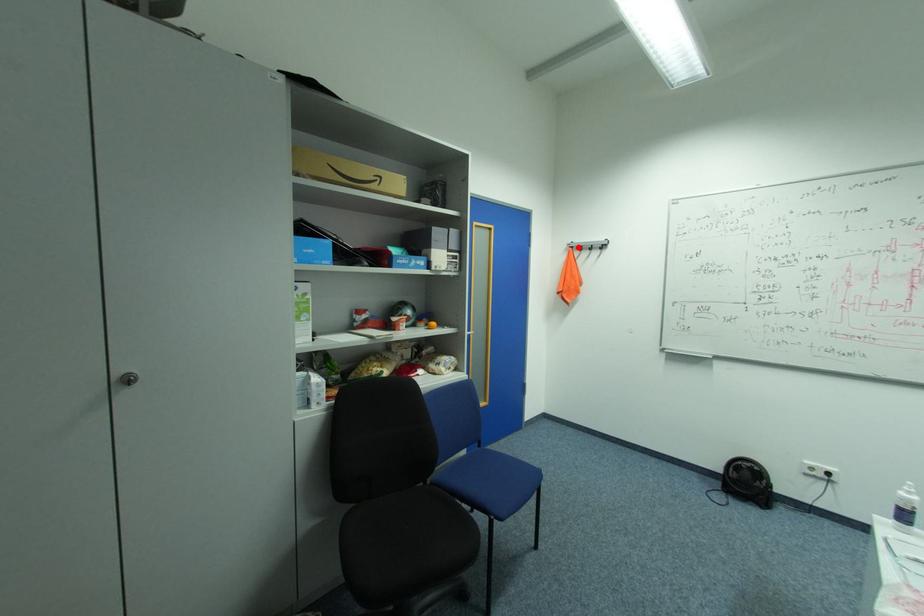
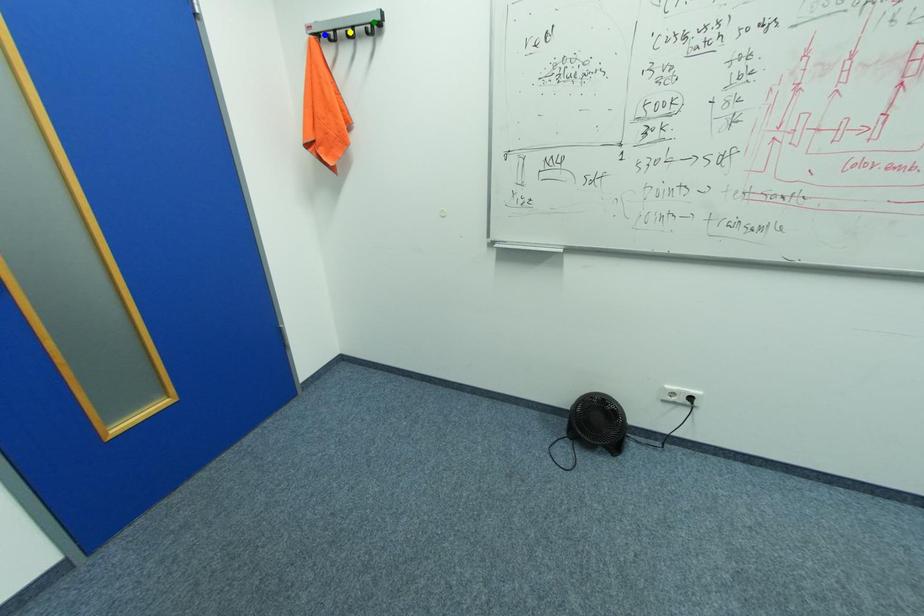
Question: I am providing you with two images of the same scene from different viewpoints. A red point is marked on the first image. You are given multiple points on the second image. Which point in image 2 represents the same 3d spot as the red point in image 1?

Choices:
 (A) green point
 (B) yellow point
 (C) blue point

Answer: (C)